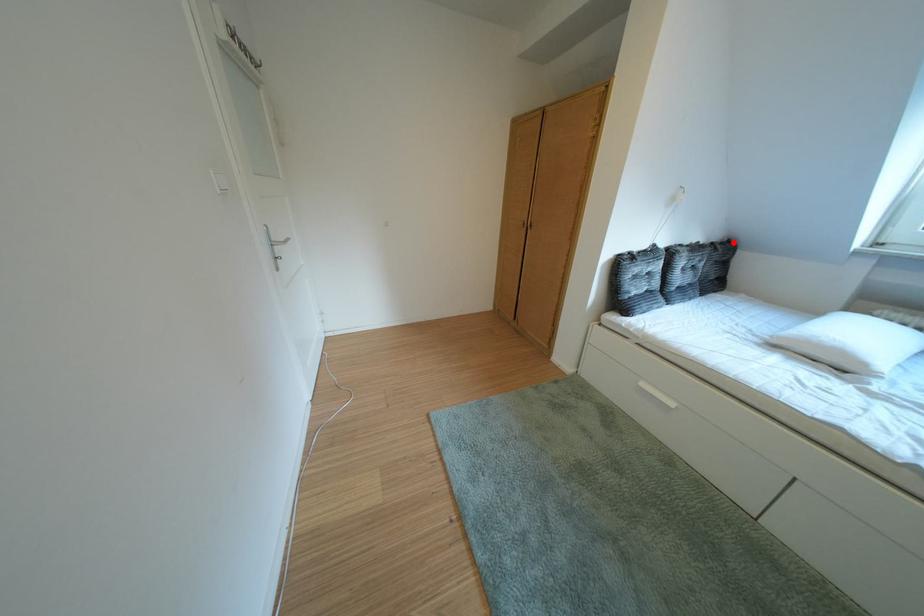
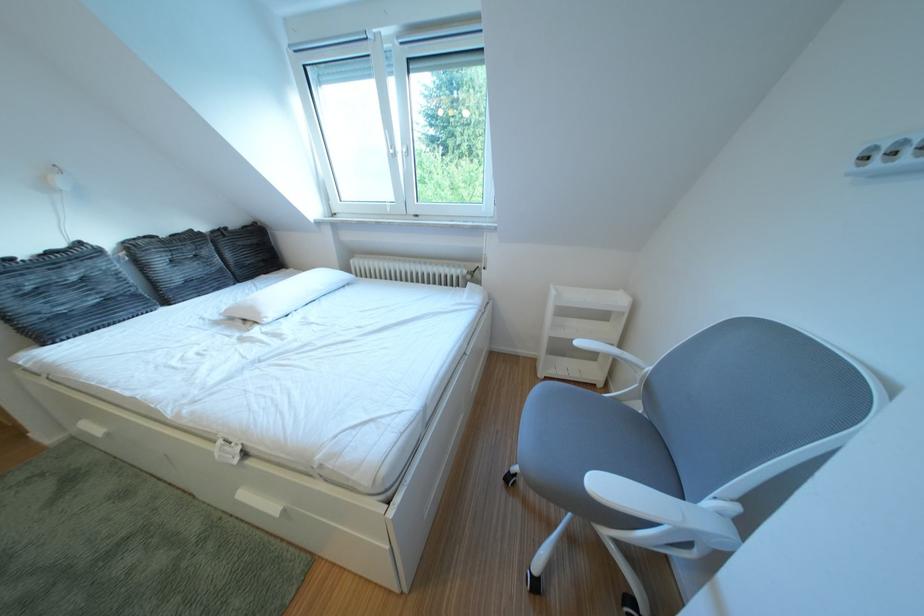
Question: I am providing you with two images of the same scene from different viewpoints. A red point is shown in image1. For the corresponding object point in image2, is it positioned nearer or farther from the camera?

Choices:
 (A) Nearer
 (B) Farther

Answer: (A)